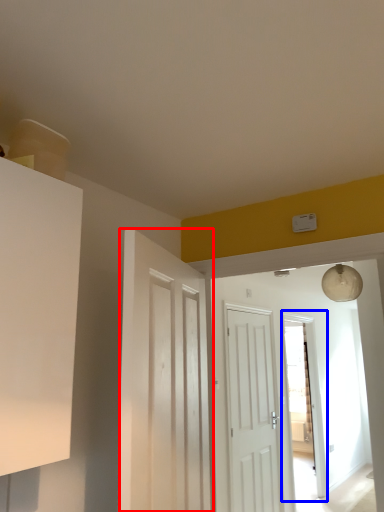
Question: Among these objects, which one is nearest to the camera, door (highlighted by a red box) or glass door (highlighted by a blue box)?

Choices:
 (A) door
 (B) glass door

Answer: (A)